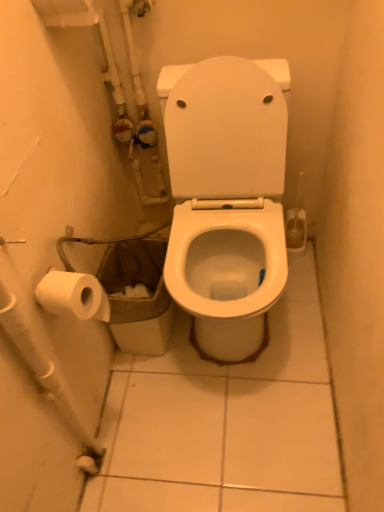
Question: Considering the relative sizes of brown paper bag at lower left and white glossy toilet at center in the image provided, is brown paper bag at lower left thinner than white glossy toilet at center?

Choices:
 (A) no
 (B) yes

Answer: (B)

Question: Considering the relative positions of brown paper bag at lower left and white glossy toilet at center in the image provided, is brown paper bag at lower left to the left of white glossy toilet at center from the viewer's perspective?

Choices:
 (A) yes
 (B) no

Answer: (A)

Question: Is brown paper bag at lower left at the right side of white glossy toilet at center?

Choices:
 (A) no
 (B) yes

Answer: (A)

Question: Considering the relative sizes of brown paper bag at lower left and white glossy toilet at center in the image provided, is brown paper bag at lower left wider than white glossy toilet at center?

Choices:
 (A) no
 (B) yes

Answer: (A)

Question: Is brown paper bag at lower left closer to camera compared to white glossy toilet at center?

Choices:
 (A) no
 (B) yes

Answer: (A)

Question: From the image's perspective, is brown paper bag at lower left on top of white glossy toilet at center?

Choices:
 (A) no
 (B) yes

Answer: (A)

Question: Does white glossy toilet at center come in front of white plastic water pipe at lower left?

Choices:
 (A) no
 (B) yes

Answer: (A)

Question: Is white glossy toilet at center not inside white plastic water pipe at lower left?

Choices:
 (A) no
 (B) yes

Answer: (B)

Question: Are white glossy toilet at center and white plastic water pipe at lower left making contact?

Choices:
 (A) no
 (B) yes

Answer: (A)

Question: Does white glossy toilet at center have a lesser height compared to white plastic water pipe at lower left?

Choices:
 (A) yes
 (B) no

Answer: (B)

Question: Does white glossy toilet at center turn towards white plastic water pipe at lower left?

Choices:
 (A) yes
 (B) no

Answer: (B)

Question: From a real-world perspective, is white glossy toilet at center beneath white plastic water pipe at lower left?

Choices:
 (A) no
 (B) yes

Answer: (B)

Question: Is brown paper bag at lower left wider than white plastic water pipe at lower left?

Choices:
 (A) no
 (B) yes

Answer: (B)